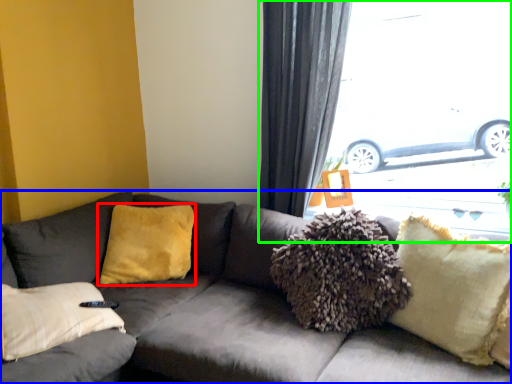
Question: Which object is positioned closest to pillow (highlighted by a red box)? Select from studio couch (highlighted by a blue box) and window (highlighted by a green box).

Choices:
 (A) studio couch
 (B) window

Answer: (A)